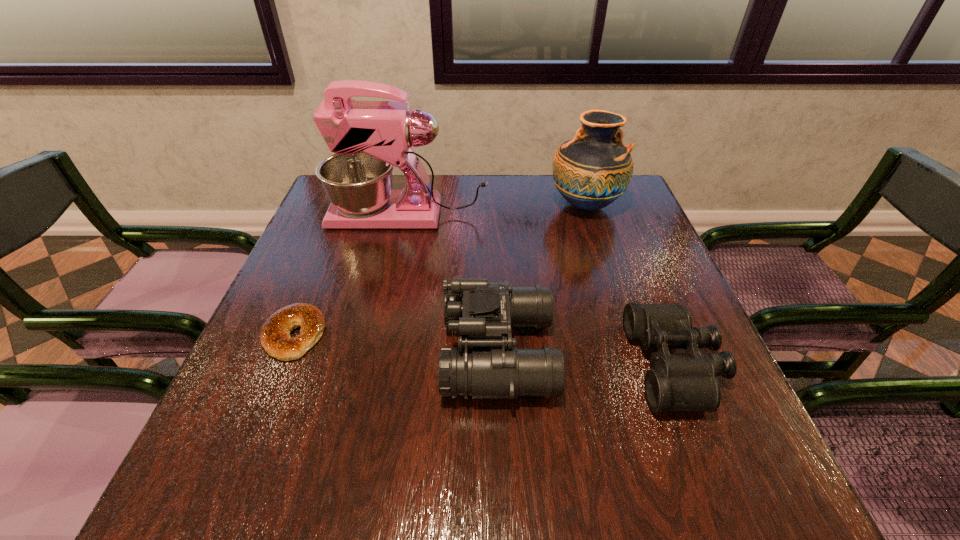
Identify the location of binoculars at the right edge. (675, 382).

The height and width of the screenshot is (540, 960). Find the location of `object at the far left corner`. object at the far left corner is located at coordinates (368, 138).

The image size is (960, 540). I want to click on object located in the far right corner section of the desktop, so click(x=591, y=171).

Identify the location of vacant space at the far edge of the desktop. (492, 177).

This screenshot has width=960, height=540. I want to click on vacant region at the near edge, so click(x=318, y=492).

Locate an element on the screen. The width and height of the screenshot is (960, 540). free location at the left edge of the desktop is located at coordinates (316, 247).

The height and width of the screenshot is (540, 960). I want to click on vacant region at the right edge of the desktop, so click(662, 301).

The image size is (960, 540). In order to click on blank space at the far right corner of the desktop in this screenshot , I will do `click(628, 200)`.

The image size is (960, 540). Identify the location of vacant area at the near right corner of the desktop. (740, 478).

Where is `free spot between the second tallest object and the shorter binoculars`? free spot between the second tallest object and the shorter binoculars is located at coordinates (630, 285).